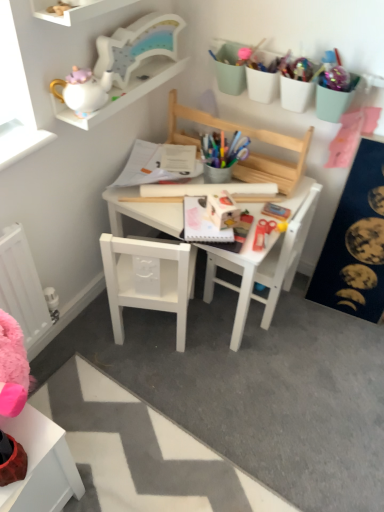
Find the location of `free area in between dark blue fabric bulletin board at right and white wooden table at center`. free area in between dark blue fabric bulletin board at right and white wooden table at center is located at coordinates (298, 328).